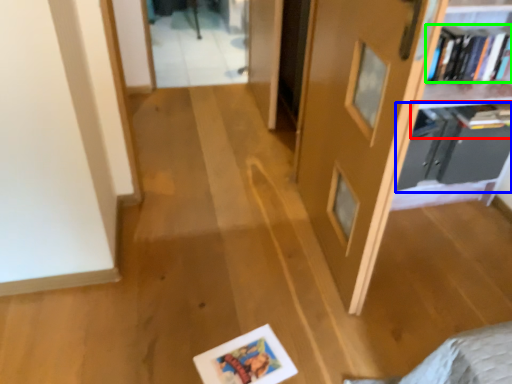
Question: Which object is the farthest from book (highlighted by a red box)? Choose among these: shelf (highlighted by a blue box) or book (highlighted by a green box).

Choices:
 (A) shelf
 (B) book

Answer: (B)